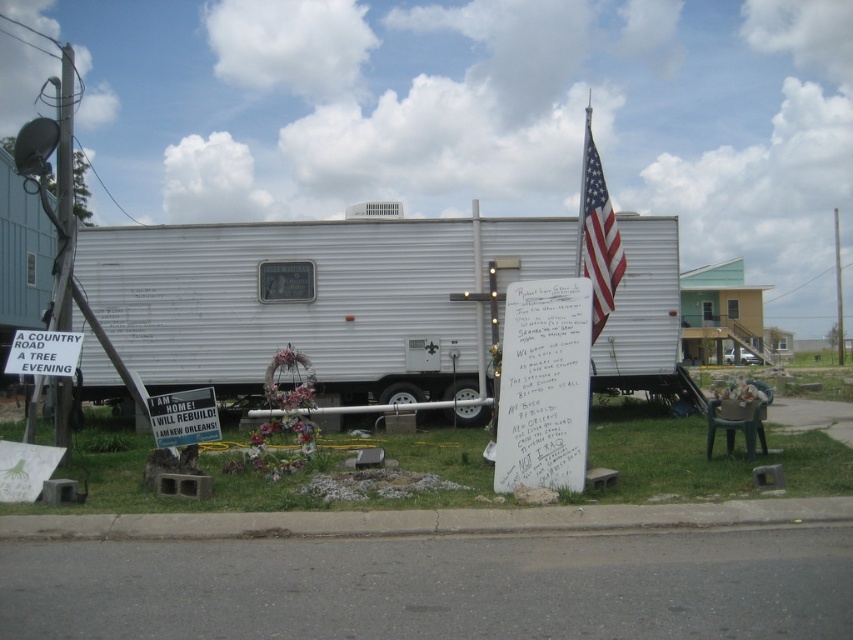
From the picture: You are standing in front of the mobile home and see the metallic silver sign at lower center and the white paper sign at lower left. Which sign is positioned more to the right side?

The metallic silver sign at lower center is positioned more to the right side than the white paper sign at lower left.

You are standing at the point marked as point (596,234). What object is located at this point?

The american flag at center is located at point (596,234).